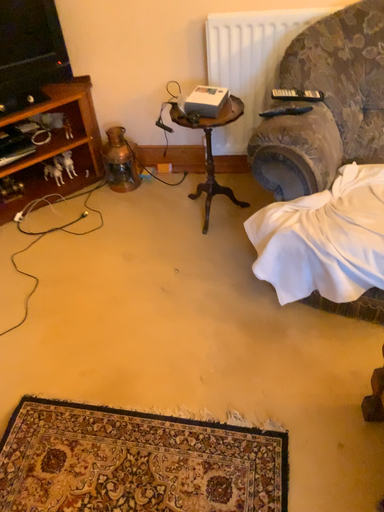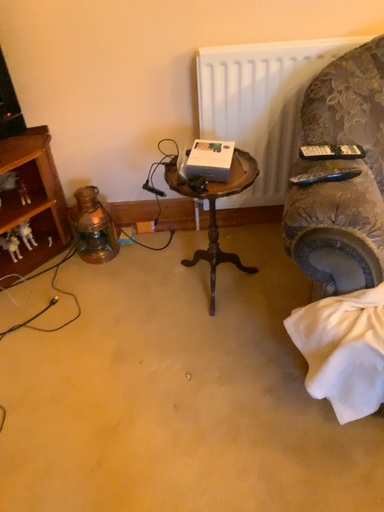
Question: Which way did the camera rotate in the video?

Choices:
 (A) rotated right
 (B) rotated left

Answer: (A)